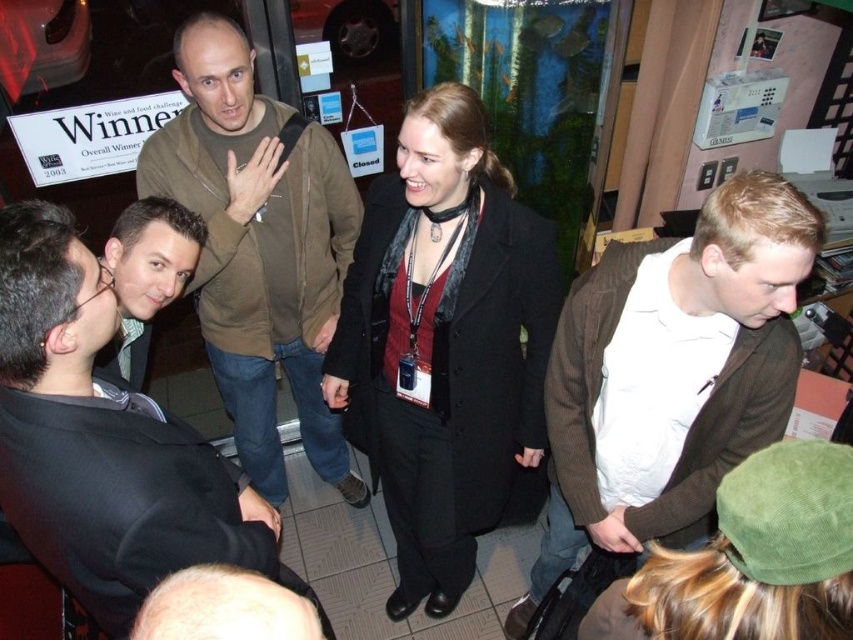
What do you see at coordinates (671, 376) in the screenshot?
I see `brown corduroy sweater at center` at bounding box center [671, 376].

Can you confirm if brown corduroy sweater at center is smaller than black suit at left?

Incorrect, brown corduroy sweater at center is not smaller in size than black suit at left.

Is point (666, 403) in front of point (4, 346)?

That is False.

Locate an element on the screen. brown corduroy sweater at center is located at coordinates (671, 376).

Is point (572, 508) positioned in front of point (328, 211)?

That is True.

Is brown corduroy sweater at center behind brown corduroy jacket at center?

No, brown corduroy sweater at center is in front of brown corduroy jacket at center.

Which is behind, point (650, 464) or point (276, 340)?

The point (276, 340) is more distant.

Identify the location of brown corduroy sweater at center. This screenshot has width=853, height=640. (671, 376).

Can you confirm if black suit at left is positioned to the right of brown corduroy jacket at center?

Yes, black suit at left is to the right of brown corduroy jacket at center.

Can you confirm if black suit at left is positioned to the left of brown corduroy jacket at center?

No, black suit at left is not to the left of brown corduroy jacket at center.

Describe the element at coordinates (105, 442) in the screenshot. I see `black suit at left` at that location.

Find the location of a particular element. black suit at left is located at coordinates (105, 442).